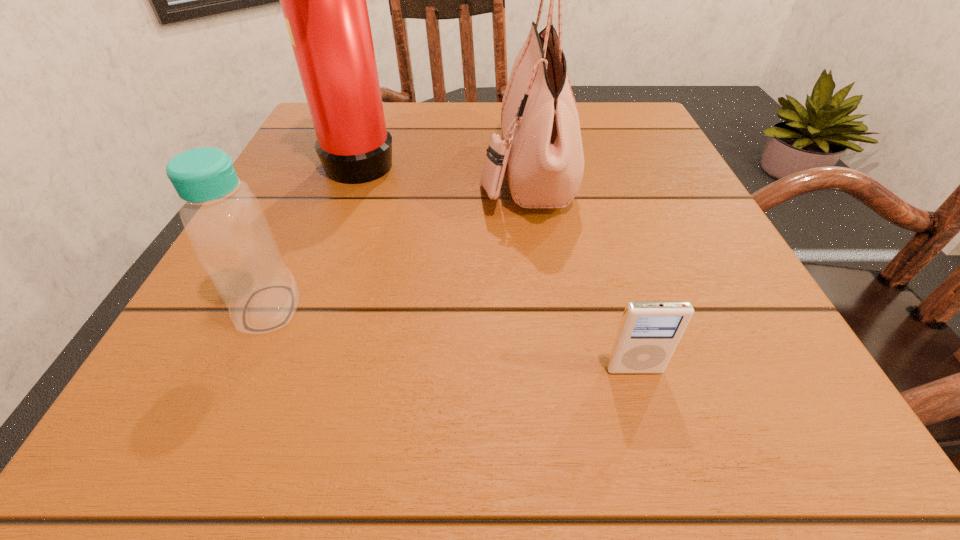
Image resolution: width=960 pixels, height=540 pixels. I want to click on vacant space that is in between the fire extinguisher and the handbag, so click(x=444, y=165).

Locate an element on the screen. vacant region between the fire extinguisher and the third tallest object is located at coordinates (315, 233).

Locate an element on the screen. Image resolution: width=960 pixels, height=540 pixels. unoccupied area between the fire extinguisher and the third tallest object is located at coordinates pyautogui.click(x=315, y=233).

Image resolution: width=960 pixels, height=540 pixels. Identify the location of free spot between the fire extinguisher and the third farthest object. (315, 233).

Identify which object is located as the nearest to the fire extinguisher. Please provide its 2D coordinates. Your answer should be formatted as a tuple, i.e. [(x, y)], where the tuple contains the x and y coordinates of a point satisfying the conditions above.

[(541, 153)]

You are a GUI agent. You are given a task and a screenshot of the screen. Output one action in this format:
    pyautogui.click(x=<x>, y=<y>)
    Task: Click on the object that is the third closest to the handbag
    This screenshot has height=540, width=960.
    Given the screenshot: What is the action you would take?
    pyautogui.click(x=224, y=221)